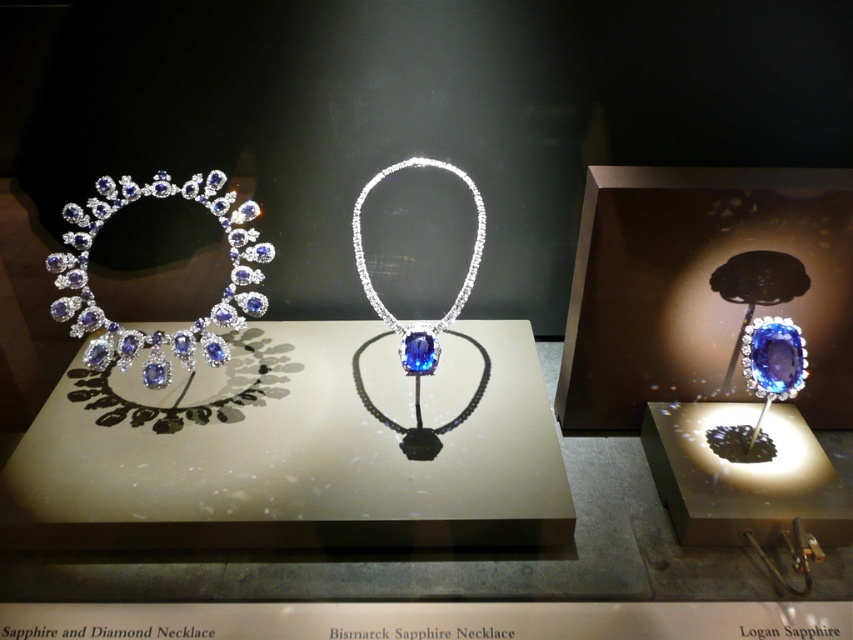
Does sapphire and diamond tiara at left have a lesser width compared to blue gemstone necklace at center?

No, sapphire and diamond tiara at left is not thinner than blue gemstone necklace at center.

Which is below, sapphire and diamond tiara at left or blue gemstone necklace at center?

sapphire and diamond tiara at left

Locate an element on the screen. Image resolution: width=853 pixels, height=640 pixels. sapphire and diamond tiara at left is located at coordinates (158, 330).